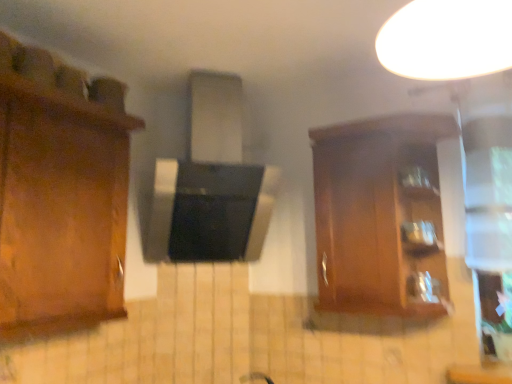
The image size is (512, 384). What do you see at coordinates (384, 215) in the screenshot?
I see `wooden cabinet at right` at bounding box center [384, 215].

Locate an element on the screen. This screenshot has width=512, height=384. wooden cabinet at right is located at coordinates (384, 215).

Locate an element on the screen. The width and height of the screenshot is (512, 384). wooden cabinet at right is located at coordinates (384, 215).